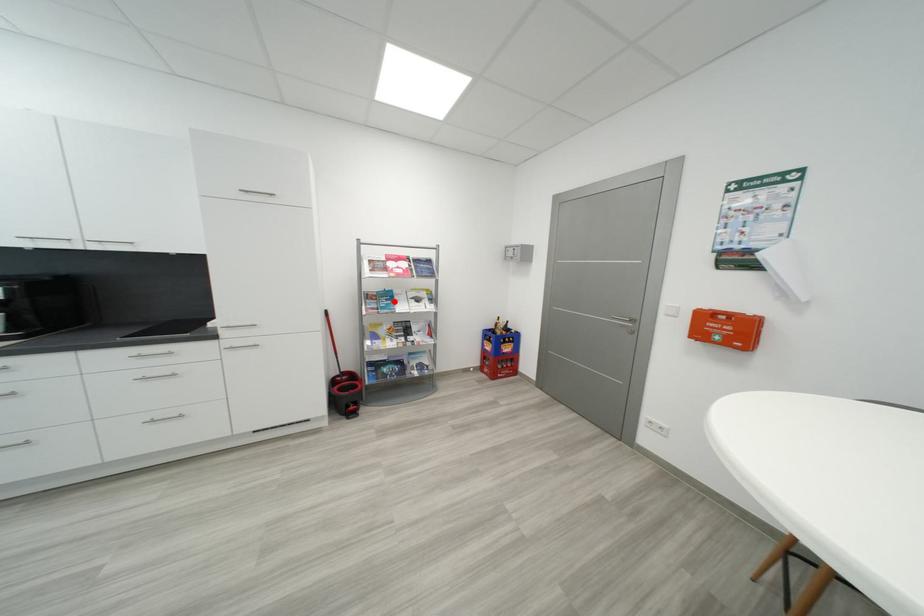
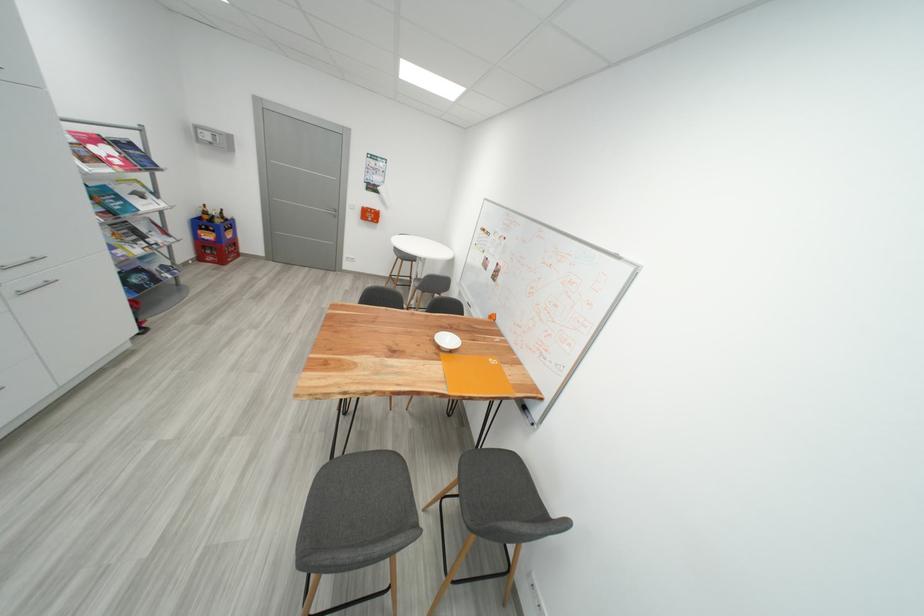
Question: I am providing you with two images of the same scene from different viewpoints. In image1, a red point is highlighted. Considering the same 3D point in image2, which of the following is correct?

Choices:
 (A) It is closer
 (B) It is farther

Answer: (B)